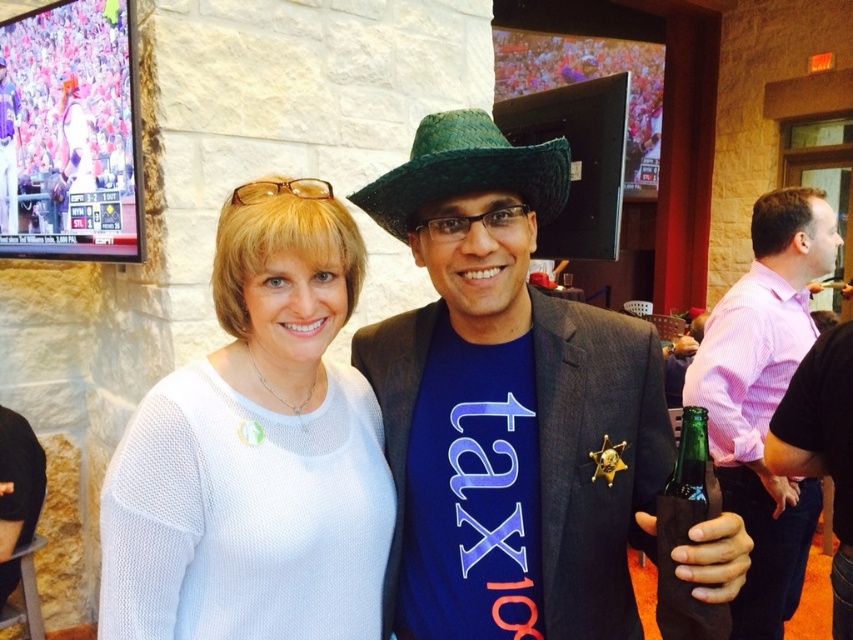
Question: Estimate the real-world distances between objects in this image. Which object is closer to the pink striped shirt at right?

Choices:
 (A) shiny blue t-shirt at center
 (B) green glass bottle at lower right
 (C) green straw cowboy hat at center
 (D) white knitted sweater at center

Answer: (A)

Question: Is green straw cowboy hat at center positioned before green glass bottle at lower right?

Choices:
 (A) yes
 (B) no

Answer: (B)

Question: Estimate the real-world distances between objects in this image. Which object is farther from the green glass bottle at lower right?

Choices:
 (A) pink striped shirt at right
 (B) white knitted sweater at center

Answer: (A)

Question: Is the position of shiny blue t-shirt at center more distant than that of pink striped shirt at right?

Choices:
 (A) no
 (B) yes

Answer: (A)

Question: Is shiny blue t-shirt at center positioned in front of green glass bottle at lower right?

Choices:
 (A) no
 (B) yes

Answer: (B)

Question: Which of the following is the farthest from the observer?

Choices:
 (A) (788, 196)
 (B) (692, 481)

Answer: (A)